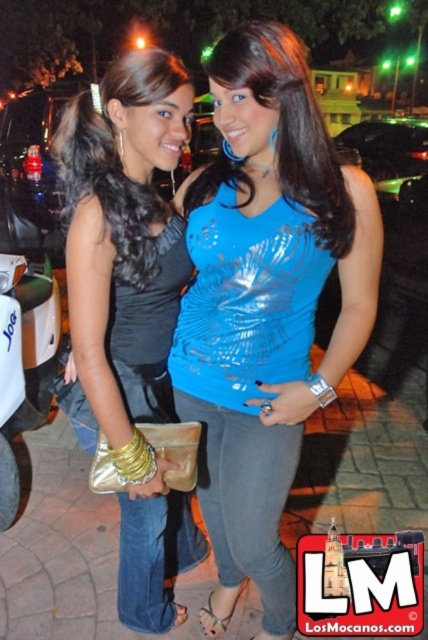
From the picture: Please provide the exact coordinates of the shiny blue tank top at center in the image.

The shiny blue tank top at center is located at coordinates point [265,305].

You are a photographer adjusting the lighting for a night photo shoot. You need to ensure that the shiny blue tank top at center is properly lit. Where should you place the spotlight relative to the point marked at coordinates point (265,305)?

The point marked at coordinates point (265,305) indicates the location of the shiny blue tank top at center, so you should place the spotlight directly at point (265,305) to ensure proper lighting.